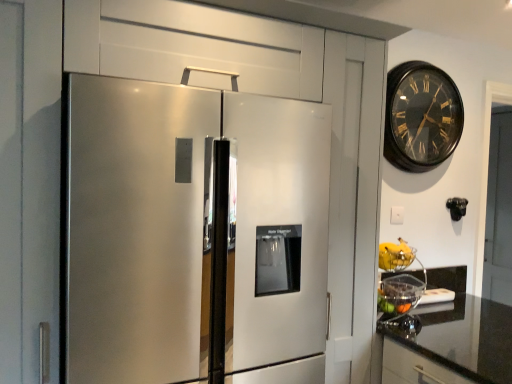
Question: Is stainless steel refrigerator at left outside of black granite countertop at lower right?

Choices:
 (A) no
 (B) yes

Answer: (B)

Question: Is stainless steel refrigerator at left further to camera compared to black granite countertop at lower right?

Choices:
 (A) yes
 (B) no

Answer: (B)

Question: Does stainless steel refrigerator at left have a lesser height compared to black granite countertop at lower right?

Choices:
 (A) no
 (B) yes

Answer: (A)

Question: From a real-world perspective, is stainless steel refrigerator at left physically above black granite countertop at lower right?

Choices:
 (A) yes
 (B) no

Answer: (A)

Question: Is stainless steel refrigerator at left oriented towards black granite countertop at lower right?

Choices:
 (A) no
 (B) yes

Answer: (A)

Question: Would you say stainless steel refrigerator at left contains black granite countertop at lower right?

Choices:
 (A) yes
 (B) no

Answer: (B)

Question: Is black wooden clock at upper right further to the viewer compared to yellow matte bananas at right?

Choices:
 (A) no
 (B) yes

Answer: (B)

Question: From a real-world perspective, is black wooden clock at upper right on top of yellow matte bananas at right?

Choices:
 (A) no
 (B) yes

Answer: (B)

Question: Is black wooden clock at upper right taller than yellow matte bananas at right?

Choices:
 (A) no
 (B) yes

Answer: (B)

Question: Can you confirm if black wooden clock at upper right is smaller than yellow matte bananas at right?

Choices:
 (A) no
 (B) yes

Answer: (A)

Question: Is yellow matte bananas at right inside black wooden clock at upper right?

Choices:
 (A) no
 (B) yes

Answer: (A)

Question: Can you confirm if black wooden clock at upper right is bigger than yellow matte bananas at right?

Choices:
 (A) yes
 (B) no

Answer: (A)

Question: Does yellow matte bananas at right come behind stainless steel refrigerator at left?

Choices:
 (A) yes
 (B) no

Answer: (A)